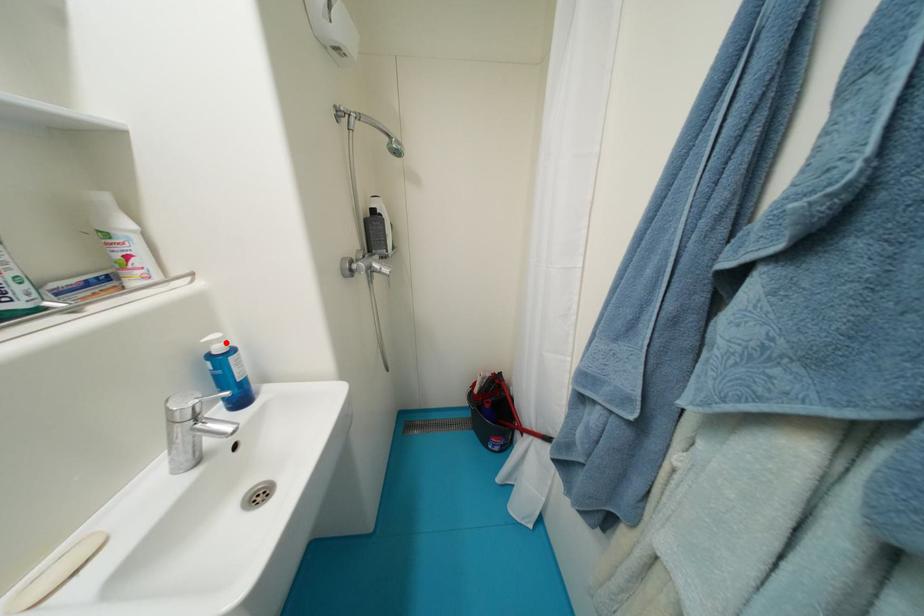
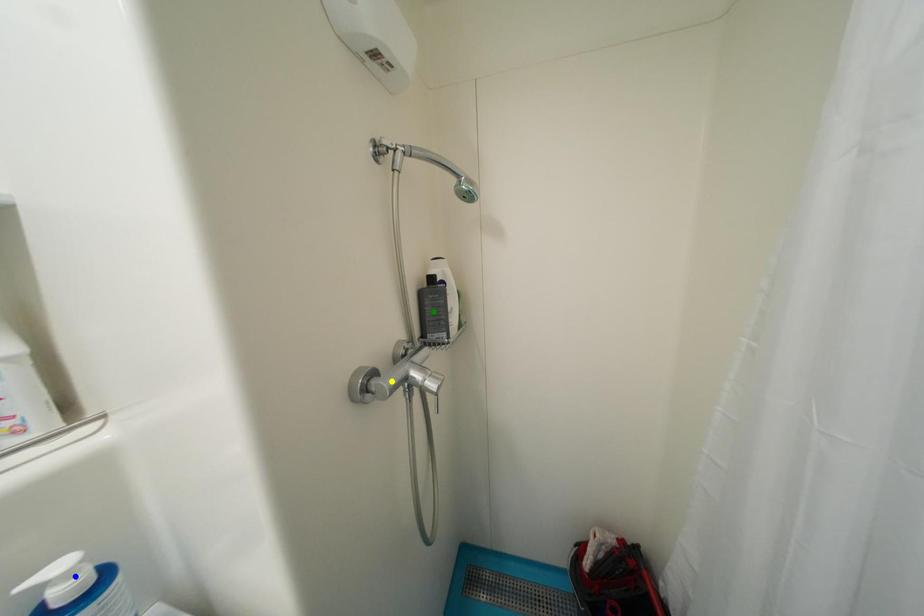
Question: I am providing you with two images of the same scene from different viewpoints. A red point is marked on the first image. You are given multiple points on the second image. Which point in image 2 represents the same 3d spot as the red point in image 1?

Choices:
 (A) green point
 (B) yellow point
 (C) blue point

Answer: (C)